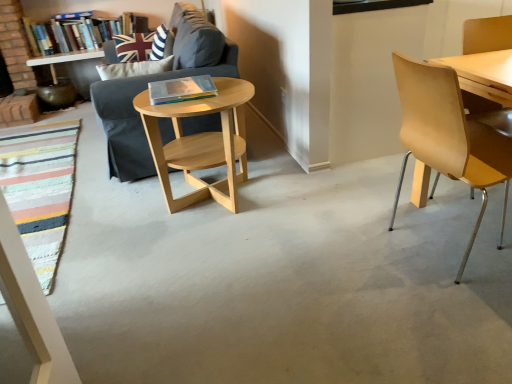
Question: From a real-world perspective, does dark gray fabric couch at center-left stand above light wood/woodenobject at center?

Choices:
 (A) yes
 (B) no

Answer: (A)

Question: Does dark gray fabric couch at center-left have a smaller size compared to light wood/woodenobject at center?

Choices:
 (A) no
 (B) yes

Answer: (A)

Question: Is dark gray fabric couch at center-left at the right side of light wood/woodenobject at center?

Choices:
 (A) yes
 (B) no

Answer: (B)

Question: Does dark gray fabric couch at center-left lie in front of light wood/woodenobject at center?

Choices:
 (A) yes
 (B) no

Answer: (B)

Question: Is dark gray fabric couch at center-left aimed at light wood/woodenobject at center?

Choices:
 (A) yes
 (B) no

Answer: (B)

Question: Considering the positions of light brown wood chair at right and union jack fabric pillow at upper left in the image, is light brown wood chair at right bigger or smaller than union jack fabric pillow at upper left?

Choices:
 (A) small
 (B) big

Answer: (B)

Question: Considering the positions of light brown wood chair at right and union jack fabric pillow at upper left in the image, is light brown wood chair at right wider or thinner than union jack fabric pillow at upper left?

Choices:
 (A) thin
 (B) wide

Answer: (B)

Question: Which is correct: light brown wood chair at right is inside union jack fabric pillow at upper left, or outside of it?

Choices:
 (A) outside
 (B) inside

Answer: (A)

Question: In terms of height, does light brown wood chair at right look taller or shorter compared to union jack fabric pillow at upper left?

Choices:
 (A) short
 (B) tall

Answer: (B)

Question: Is hardcover book at center, which is the 1th book from front to back, taller or shorter than dark gray fabric couch at center-left?

Choices:
 (A) short
 (B) tall

Answer: (A)

Question: From the image's perspective, is hardcover book at center, which is counted as the 2th book, starting from the back, above or below dark gray fabric couch at center-left?

Choices:
 (A) below
 (B) above

Answer: (A)

Question: Relative to dark gray fabric couch at center-left, is hardcover book at center, arranged as the 1th book when viewed from the right, in front or behind?

Choices:
 (A) front
 (B) behind

Answer: (A)

Question: Is hardcover book at center, which is counted as the 2th book, starting from the back, inside the boundaries of dark gray fabric couch at center-left, or outside?

Choices:
 (A) outside
 (B) inside

Answer: (A)

Question: Is light wood/woodenobject at center wider or thinner than hardcover book at upper left, which is the first book in top-to-bottom order?

Choices:
 (A) thin
 (B) wide

Answer: (B)

Question: Considering their positions, is light wood/woodenobject at center located in front of or behind hardcover book at upper left, the 2th book from the right?

Choices:
 (A) behind
 (B) front

Answer: (B)